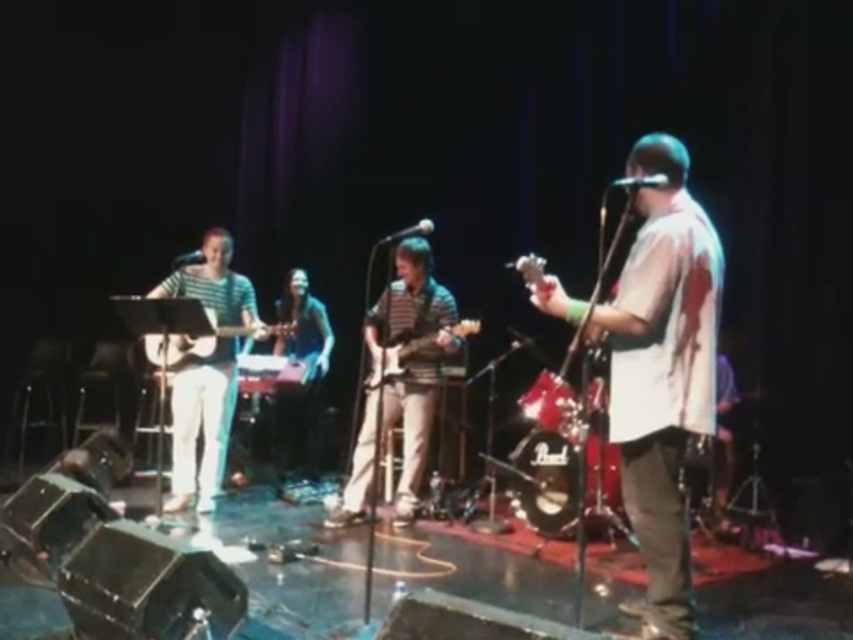
Question: Is striped fabric guitar at center closer to the viewer compared to glossy wood electric guitar at center?

Choices:
 (A) no
 (B) yes

Answer: (A)

Question: Which point appears closest to the camera in this image?

Choices:
 (A) (316, 378)
 (B) (201, 348)

Answer: (B)

Question: Does striped shirt at center lie in front of glossy wood electric guitar at center?

Choices:
 (A) no
 (B) yes

Answer: (B)

Question: Which point is farther to the camera?

Choices:
 (A) (437, 346)
 (B) (405, 429)

Answer: (B)

Question: Which object appears closest to the camera in this image?

Choices:
 (A) matte wood acoustic guitar at center
 (B) shiny black guitar at center
 (C) striped fabric guitar at center

Answer: (A)

Question: Does striped shirt at center appear on the right side of shiny black guitar at center?

Choices:
 (A) yes
 (B) no

Answer: (A)